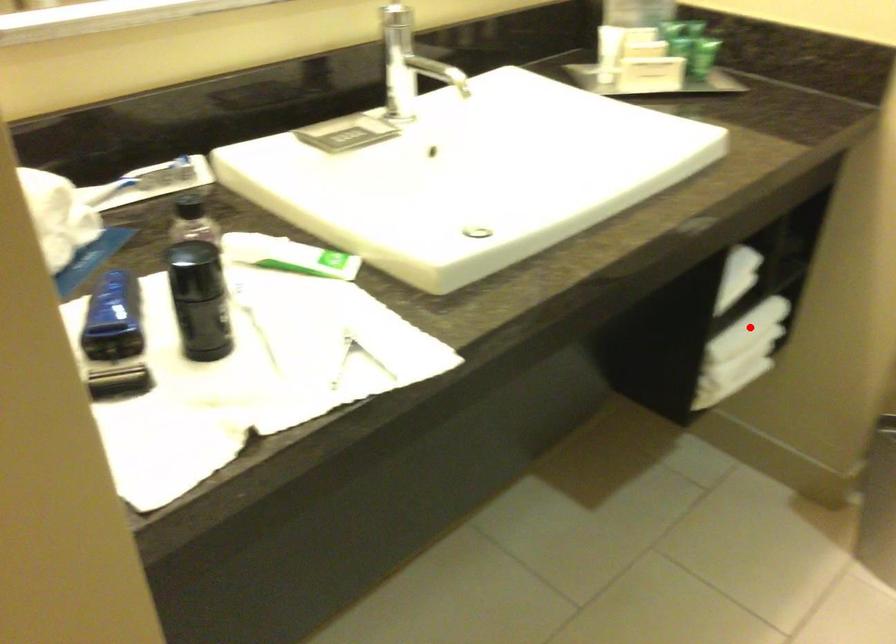
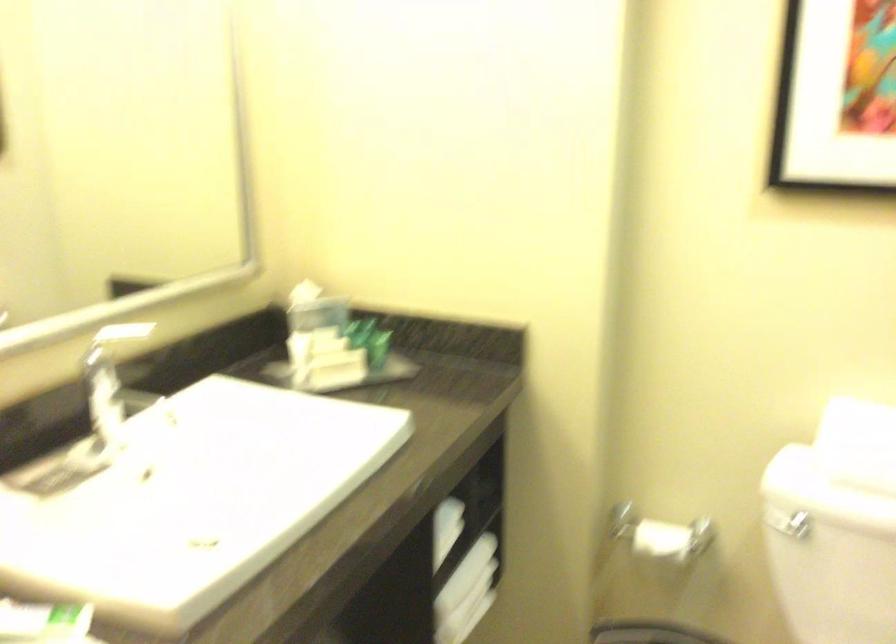
Question: I am providing you with two images of the same scene from different viewpoints. A red point is marked on the first image. Is the red point's position out of view in image 2?

Choices:
 (A) Yes
 (B) No

Answer: (B)